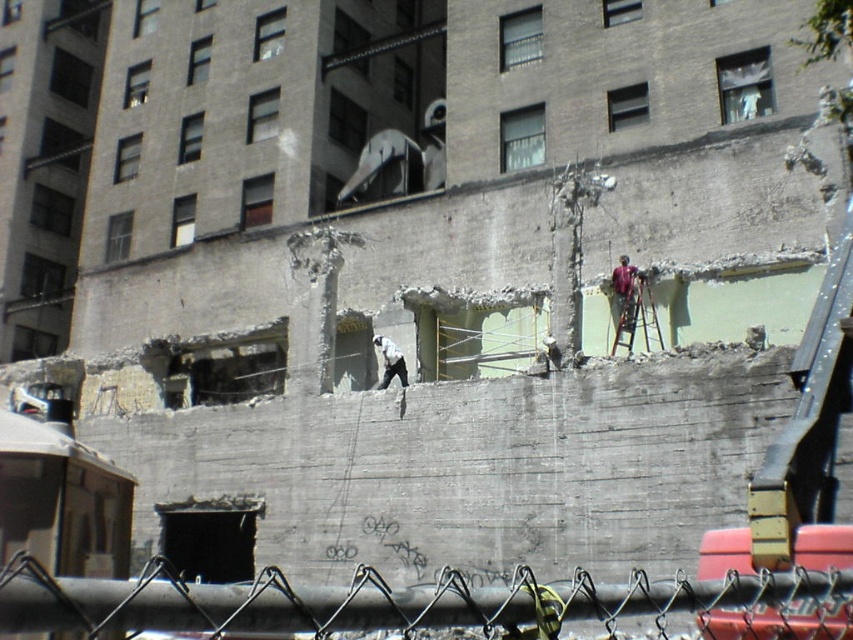
Question: From the image, what is the correct spatial relationship of metallic chain-link fence at lower center in relation to white matte helmet at center?

Choices:
 (A) below
 (B) above

Answer: (A)

Question: Does metallic chain-link fence at lower center come behind white matte helmet at center?

Choices:
 (A) yes
 (B) no

Answer: (B)

Question: Which object appears closest to the camera in this image?

Choices:
 (A) metallic chain-link fence at lower center
 (B) white matte helmet at center

Answer: (A)

Question: From the image, what is the correct spatial relationship of metallic chain-link fence at lower center in relation to white matte helmet at center?

Choices:
 (A) below
 (B) above

Answer: (A)